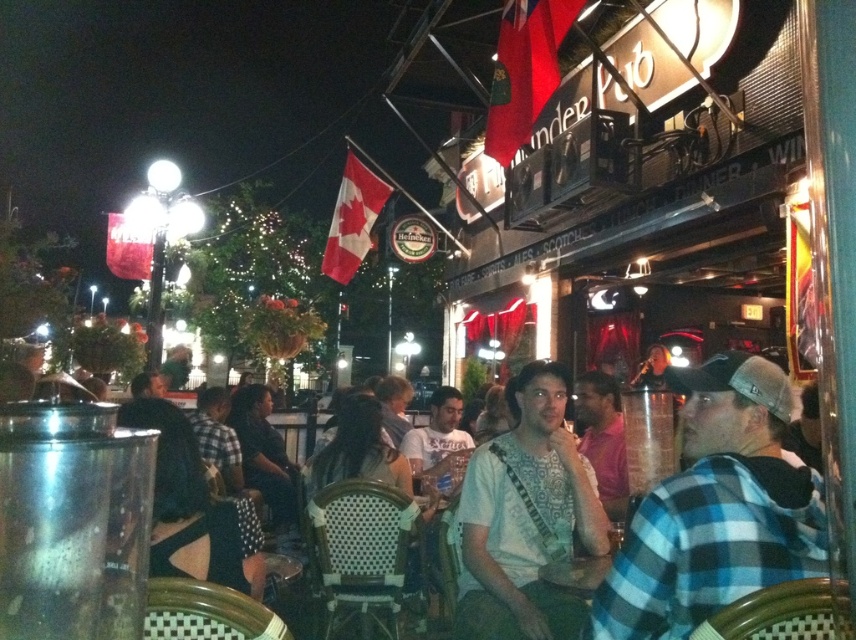
What do you see at coordinates (526, 516) in the screenshot?
I see `white fabric shirt at center` at bounding box center [526, 516].

Which is behind, point (574, 624) or point (414, 442)?

Positioned behind is point (414, 442).

Where is `white fabric shirt at center`? Image resolution: width=856 pixels, height=640 pixels. white fabric shirt at center is located at coordinates (526, 516).

What do you see at coordinates (716, 508) in the screenshot? This screenshot has height=640, width=856. I see `blue plaid shirt at center` at bounding box center [716, 508].

Between blue plaid shirt at center and white fabric shirt at center, which one has more height?

Standing taller between the two is white fabric shirt at center.

Describe the element at coordinates (716, 508) in the screenshot. I see `blue plaid shirt at center` at that location.

Identify the location of blue plaid shirt at center. This screenshot has height=640, width=856. (716, 508).

Between blue plaid shirt at center and white cotton t-shirt at center, which one appears on the right side from the viewer's perspective?

blue plaid shirt at center is more to the right.

Does blue plaid shirt at center appear over white cotton t-shirt at center?

Indeed, blue plaid shirt at center is positioned over white cotton t-shirt at center.

Which is in front, point (801, 561) or point (415, 456)?

Point (801, 561) is in front.

Find the location of a particular element. blue plaid shirt at center is located at coordinates (716, 508).